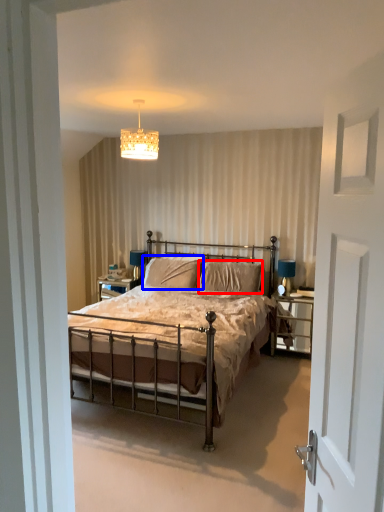
Question: Which object appears closest to the camera in this image, pillow (highlighted by a red box) or pillow (highlighted by a blue box)?

Choices:
 (A) pillow
 (B) pillow

Answer: (A)